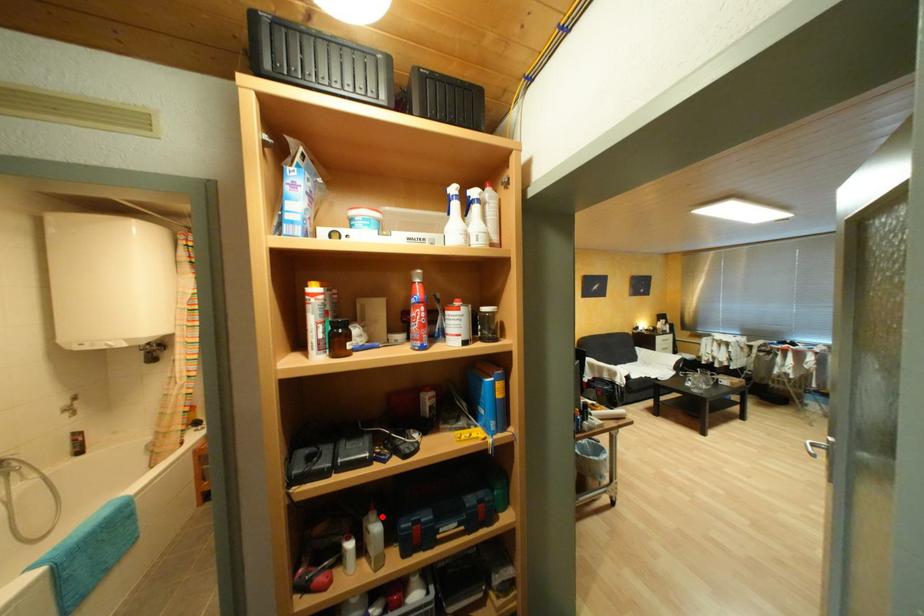
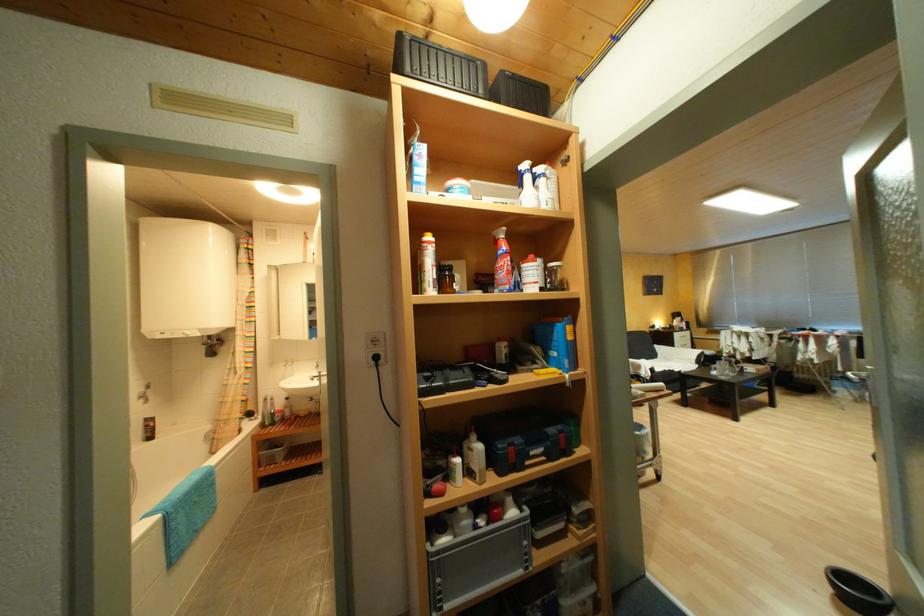
Question: I am providing you with two images of the same scene from different viewpoints. A red point is shown in image1. For the corresponding object point in image2, is it positioned nearer or farther from the camera?

Choices:
 (A) Nearer
 (B) Farther

Answer: (B)